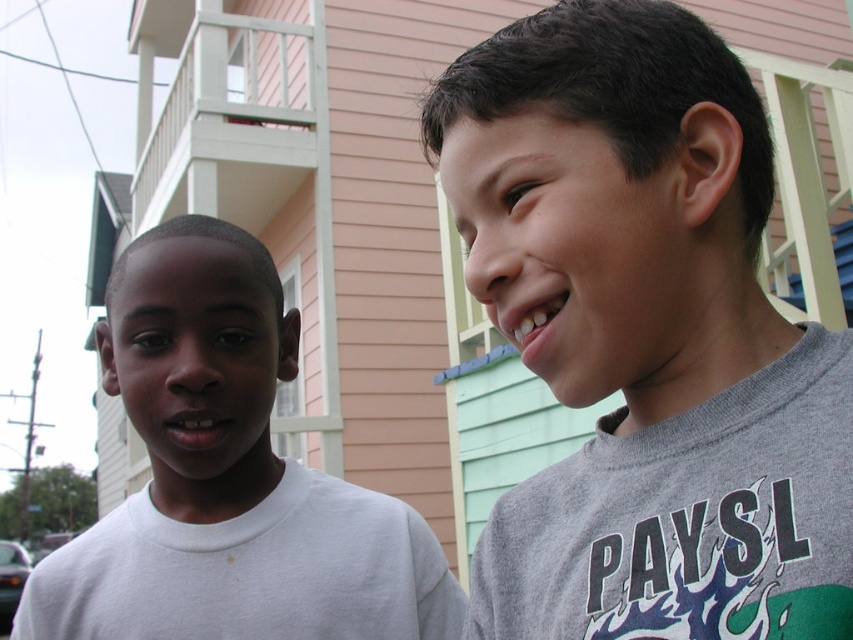
Question: Does gray cotton t-shirt at right have a smaller size compared to white matte shirt at left?

Choices:
 (A) no
 (B) yes

Answer: (B)

Question: Which of the following is the closest to the observer?

Choices:
 (A) (485, 614)
 (B) (141, 241)

Answer: (A)

Question: Can you confirm if gray cotton t-shirt at right is smaller than white matte shirt at left?

Choices:
 (A) no
 (B) yes

Answer: (B)

Question: From the image, what is the correct spatial relationship of gray cotton t-shirt at right in relation to white matte shirt at left?

Choices:
 (A) below
 (B) above

Answer: (B)